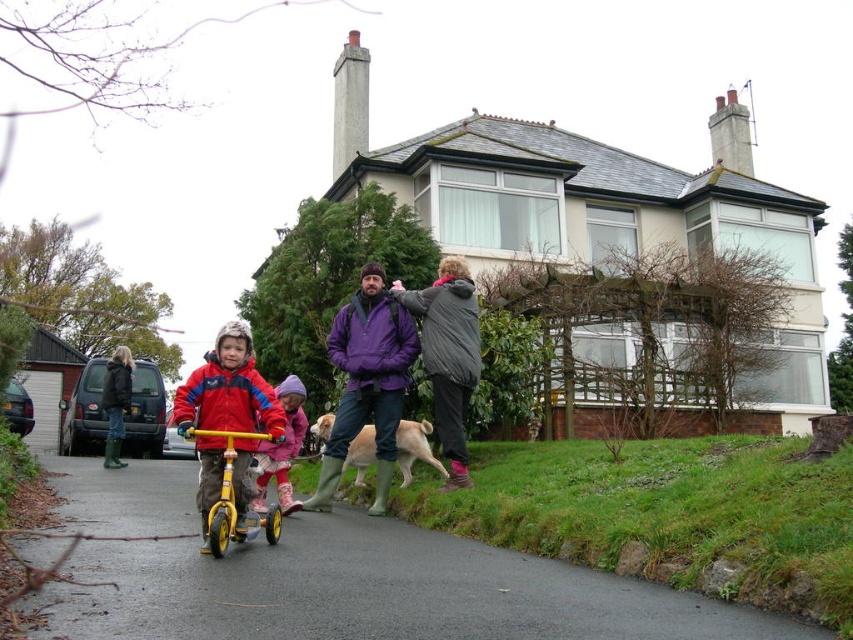
Consider the image. You are a photographer trying to capture a photo of the purple matte jacket at center and the yellow matte bicycle at center. Which object should you focus on first if you want to ensure both are in the frame without moving the camera?

The purple matte jacket at center is shorter than the yellow matte bicycle at center. Since the purple matte jacket at center is closer to the camera, you should focus on it first to ensure both are in frame without moving the camera.

You are a photographer trying to capture a photo of the purple matte jacket at center and the matte pink snowsuit at center. Since you want both subjects to be in focus, which one should you adjust your camera focus on first?

You should focus on the purple matte jacket at center first because it is closer to you than the matte pink snowsuit at center, ensuring both are in focus when using depth of field appropriately.